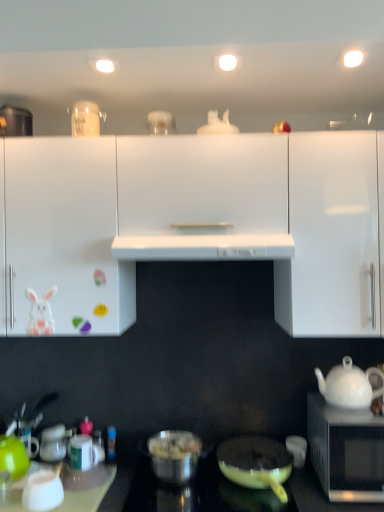
Identify the location of free point above shiny metallic pot at center, which is the 1th pot/pan from left to right (from a real-world perspective). The width and height of the screenshot is (384, 512). (172, 438).